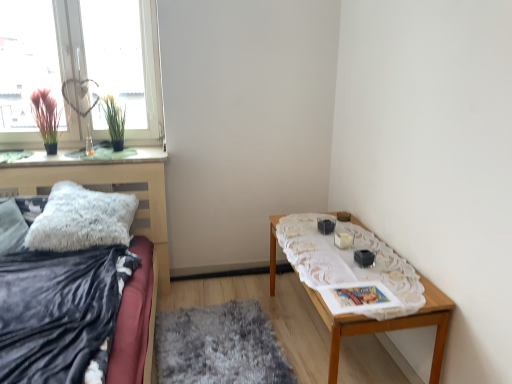
Locate an element on the screen. The height and width of the screenshot is (384, 512). vacant area to the right of green grass-like plant at upper left, positioned as the 1th plant in right-to-left order is located at coordinates (146, 149).